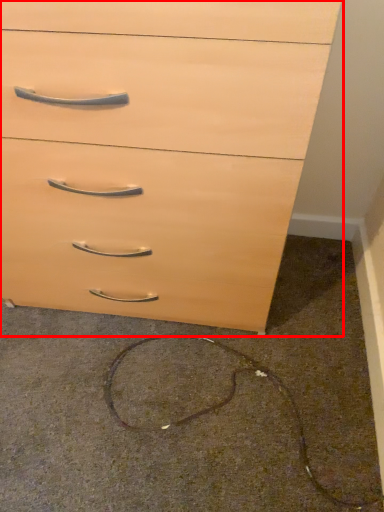
Question: From the image's perspective, what is the correct spatial relationship of chest of drawers (annotated by the red box) in relation to concrete?

Choices:
 (A) above
 (B) below

Answer: (A)